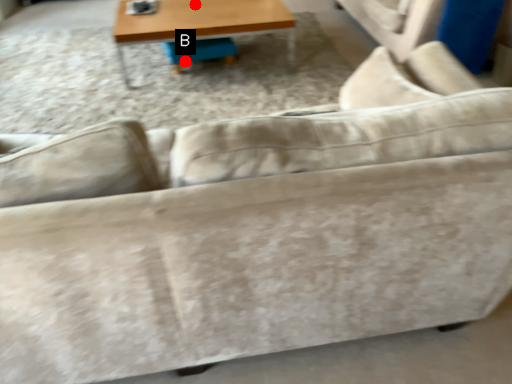
Question: Two points are circled on the image, labeled by A and B beside each circle. Among these points, which one is nearest to the camera?

Choices:
 (A) A is closer
 (B) B is closer

Answer: (A)